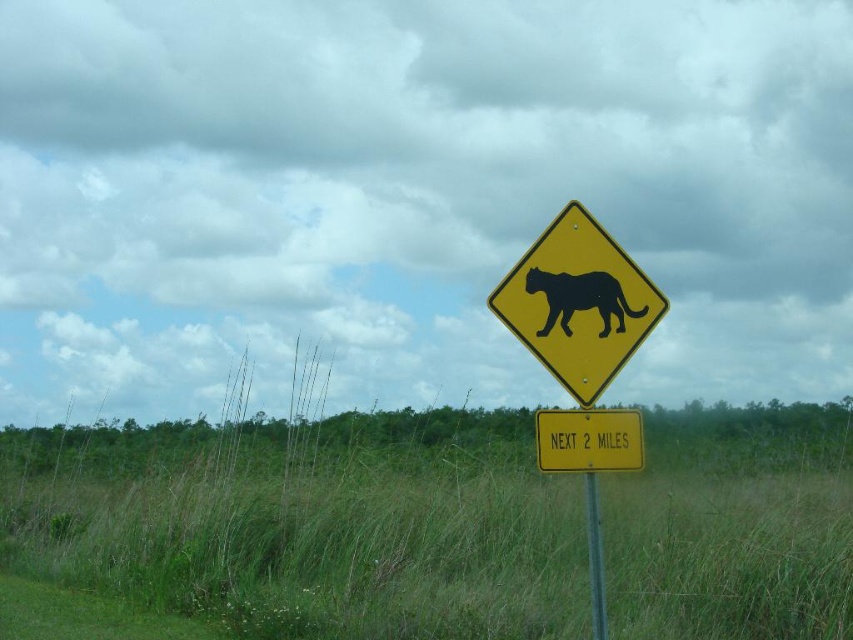
Does yellow/yellowish metal/texture sign at center appear on the left side of yellow metal pole at center?

Yes, yellow/yellowish metal/texture sign at center is to the left of yellow metal pole at center.

Which of these two, yellow/yellowish metal/texture sign at center or yellow metal pole at center, stands shorter?

yellow/yellowish metal/texture sign at center

Does point (585, 426) come behind point (601, 612)?

No, (585, 426) is in front of (601, 612).

Where is `yellow/yellowish metal/texture sign at center`? This screenshot has height=640, width=853. yellow/yellowish metal/texture sign at center is located at coordinates (589, 440).

Does black glossy panther at center come behind yellow metal pole at center?

That is True.

Does black glossy panther at center have a greater width compared to yellow metal pole at center?

Yes.

At what (x,y) coordinates should I click in order to perform the action: click on black glossy panther at center. Please return your answer as a coordinate pair (x, y). This screenshot has height=640, width=853. Looking at the image, I should click on (579, 298).

At what (x,y) coordinates should I click in order to perform the action: click on black glossy panther at center. Please return your answer as a coordinate pair (x, y). Looking at the image, I should click on (579, 298).

In the scene shown: Which is more to the right, yellow/yellowish metal/texture sign at center or black glossy panther at center?

yellow/yellowish metal/texture sign at center is more to the right.

Can you confirm if yellow/yellowish metal/texture sign at center is positioned to the left of black glossy panther at center?

Incorrect, yellow/yellowish metal/texture sign at center is not on the left side of black glossy panther at center.

Locate an element on the screen. The width and height of the screenshot is (853, 640). yellow/yellowish metal/texture sign at center is located at coordinates [x=589, y=440].